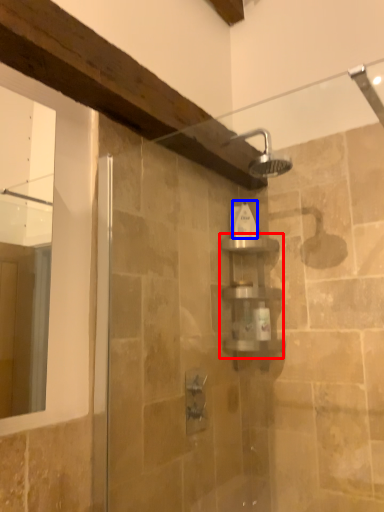
Question: Which of the following is the closest to the observer, shelf (highlighted by a red box) or toiletry (highlighted by a blue box)?

Choices:
 (A) shelf
 (B) toiletry

Answer: (A)